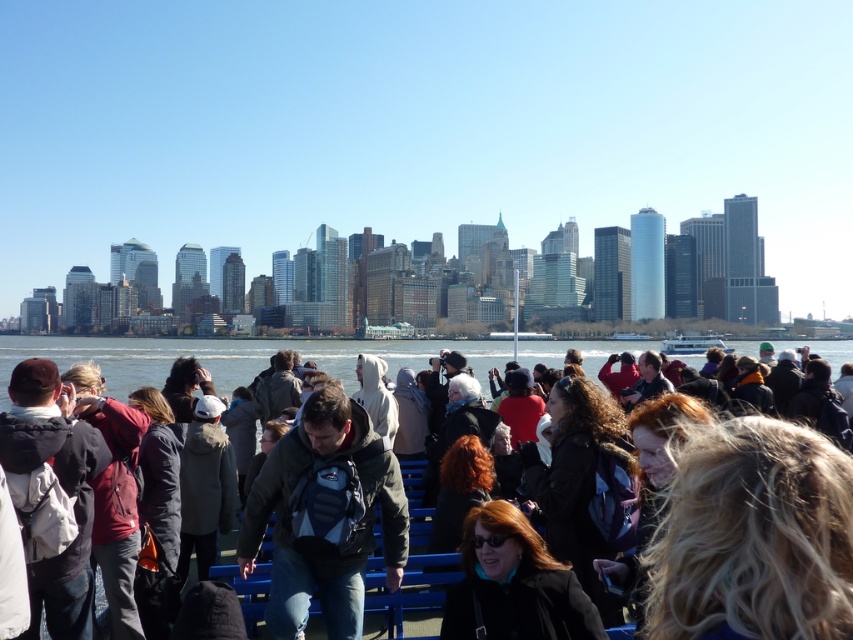
You are a photographer trying to capture a photo of the waterfront scene. You notice two people in the foreground, one with blonde hair at lower right and another wearing a matte red jacket at left. Which of these two people is smaller in the photo?

The blonde hair at lower right is smaller than the matte red jacket at left in the photo because it occupies less space.

You are a photographer positioned at the waterfront. You notice a person with blonde hair at lower right and clear water at center in your viewfinder. Which object is closer to the camera based on their positions?

The blonde hair at lower right is closer to the camera than the clear water at center because objects that appear taller in the frame are typically closer to the viewer.